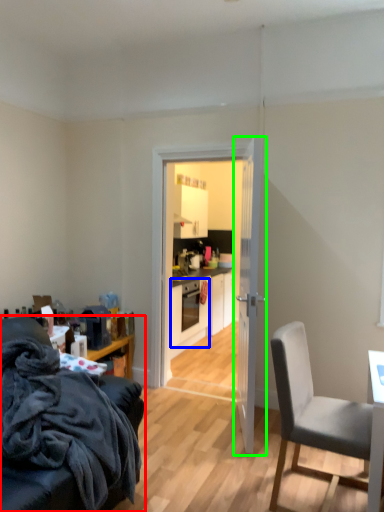
Question: Which is nearer to the chair (highlighted by a red box)? oven (highlighted by a blue box) or door (highlighted by a green box).

Choices:
 (A) oven
 (B) door

Answer: (B)